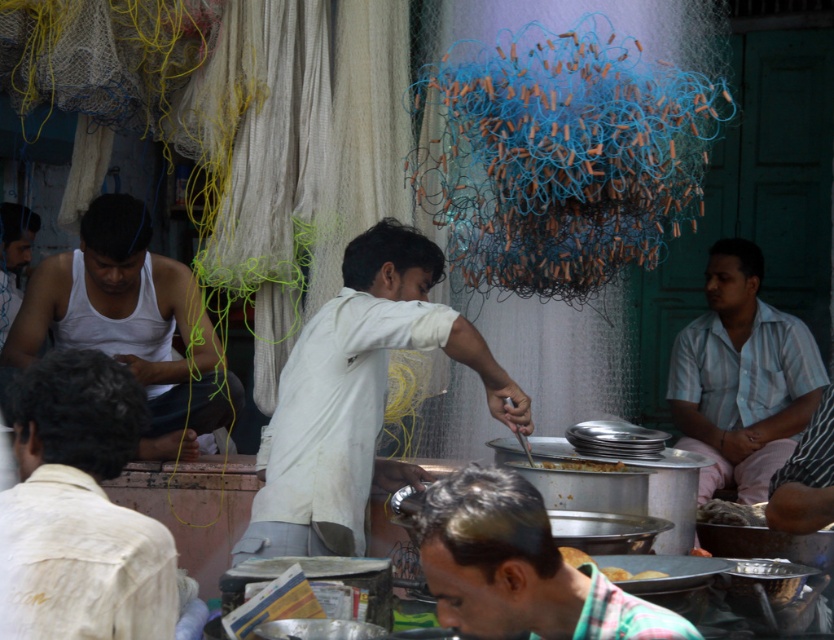
Does light beige shirt at lower left appear on the left side of yellow matte bread at center?

Indeed, light beige shirt at lower left is positioned on the left side of yellow matte bread at center.

Between light beige shirt at lower left and yellow matte bread at center, which one has more height?

Standing taller between the two is light beige shirt at lower left.

Which is in front, point (9, 593) or point (606, 568)?

Point (9, 593) is more forward.

Locate an element on the screen. The image size is (834, 640). light beige shirt at lower left is located at coordinates (79, 509).

Is green plaid shirt at center above golden brown bread at center?

No.

Consider the image. Does green plaid shirt at center have a larger size compared to golden brown bread at center?

Indeed, green plaid shirt at center has a larger size compared to golden brown bread at center.

Locate an element on the screen. This screenshot has height=640, width=834. green plaid shirt at center is located at coordinates (520, 566).

Between white cotton shirt at center and yellow matte bread at center, which one has less height?

With less height is yellow matte bread at center.

Is white cotton shirt at center thinner than yellow matte bread at center?

No, white cotton shirt at center is not thinner than yellow matte bread at center.

Is point (421, 320) positioned after point (613, 572)?

Yes, point (421, 320) is behind point (613, 572).

The width and height of the screenshot is (834, 640). Find the location of `white cotton shirt at center`. white cotton shirt at center is located at coordinates (357, 396).